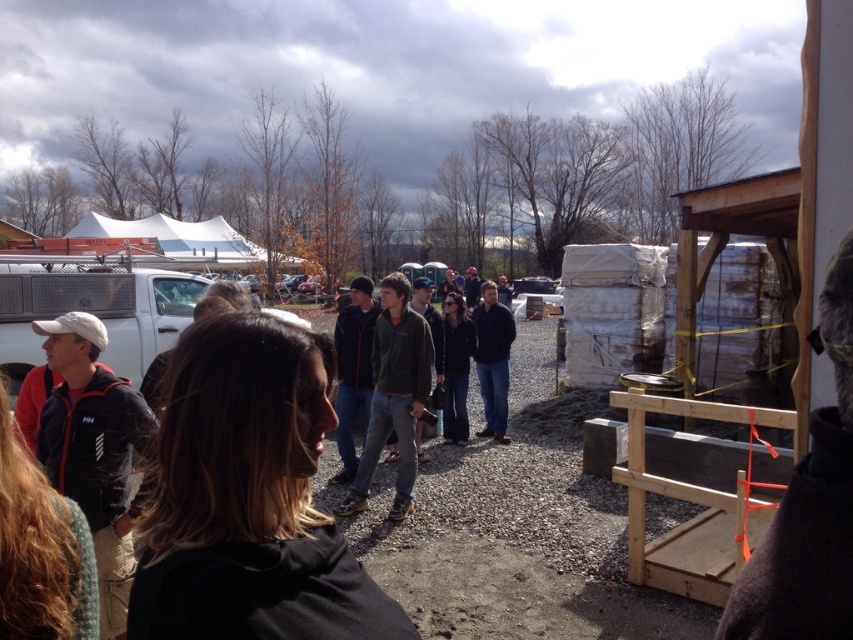
Question: Is green matte jacket at center wider than dark blue jacket at center?

Choices:
 (A) no
 (B) yes

Answer: (A)

Question: Does green matte jacket at center appear over dark blue jacket at center?

Choices:
 (A) yes
 (B) no

Answer: (B)

Question: Is green matte jacket at center to the left of dark blue jacket at center from the viewer's perspective?

Choices:
 (A) yes
 (B) no

Answer: (A)

Question: Which object is farther from the camera taking this photo?

Choices:
 (A) green matte jacket at center
 (B) dark blue jacket at center

Answer: (B)